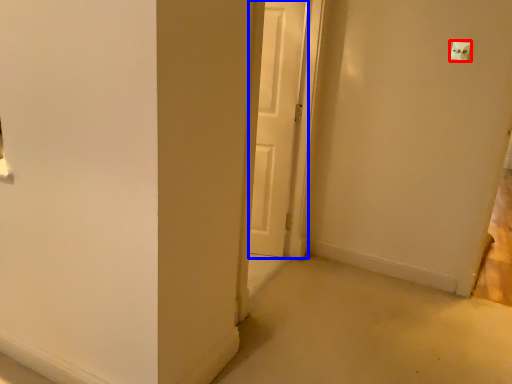
Question: Which object is further to the camera taking this photo, light switch (highlighted by a red box) or door (highlighted by a blue box)?

Choices:
 (A) light switch
 (B) door

Answer: (B)